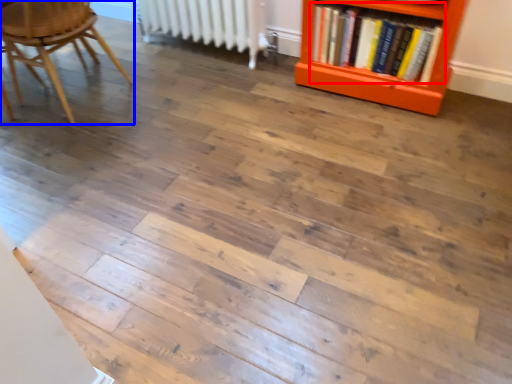
Question: Among these objects, which one is nearest to the camera, book (highlighted by a red box) or chair (highlighted by a blue box)?

Choices:
 (A) book
 (B) chair

Answer: (B)